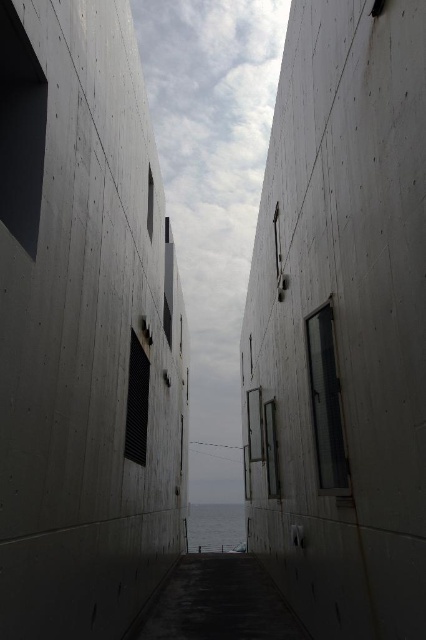
You are standing at the entrance of the alleyway and see two points marked in the image. One is at point coordinates point [106,385] and the other is at point coordinates point [307,378]. Which point is closer to you?

Point [106,385] is closer to the viewer than point [307,378].

You are standing in the alleyway and want to step onto the blue water at center. Is the smooth concrete wall at center blocking your path directly in front of you?

The smooth concrete wall at center is closer to the viewer than the blue water at center, so yes, the wall is blocking your path directly in front of you.

You are standing at point (85, 330) in the alleyway. What is the immediate surface you are facing?

The immediate surface at point (85, 330) is the concrete textured wall at center.